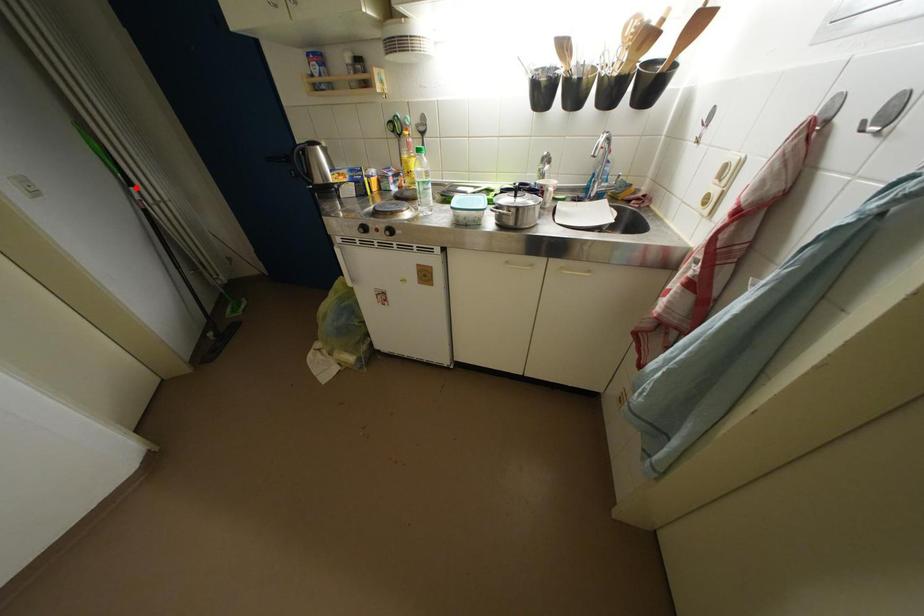
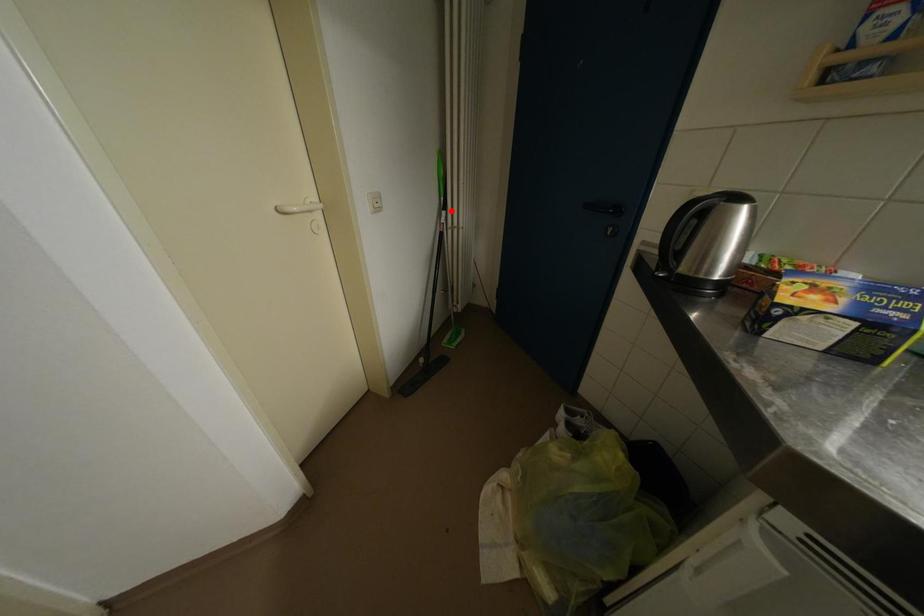
I am providing you with two images of the same scene from different viewpoints. A red point is marked on the first image and another point is marked on the second image. Does the point marked in image1 correspond to the same location as the one in image2?

Yes